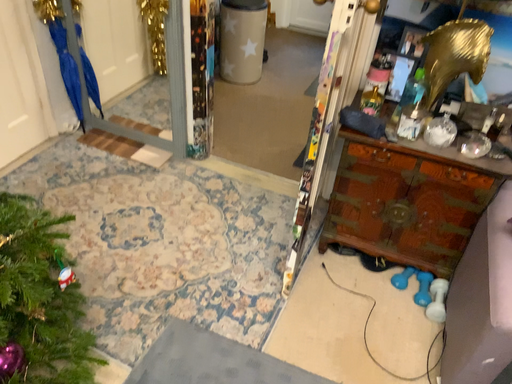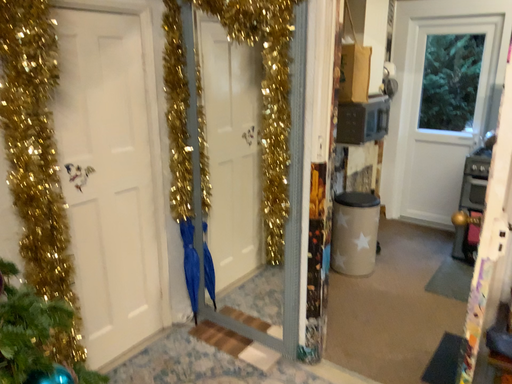
Question: How did the camera likely rotate when shooting the video?

Choices:
 (A) rotated right
 (B) rotated left

Answer: (B)